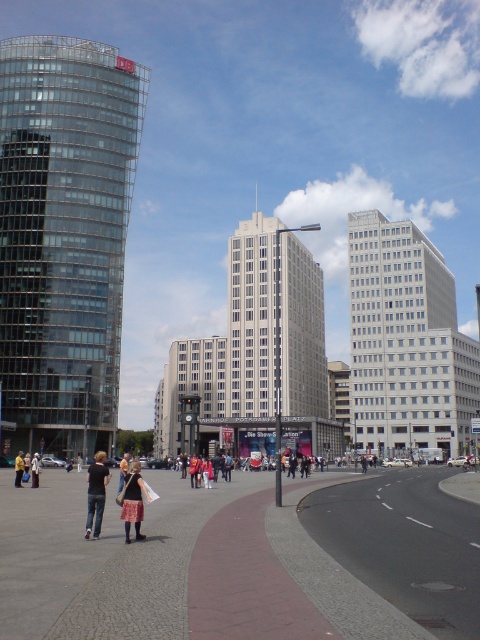
You are a photographer trying to capture the glassy modern skyscraper at left and the yellow fabric bag at lower center in the same frame. Based on their sizes, which object should you focus on first to ensure both are in the shot?

The glassy modern skyscraper at left is wider than the yellow fabric bag at lower center, so you should focus on the glassy modern skyscraper at left first to ensure both fit in the frame.

In the scene shown: You are a tourist visiting Potsdamer Platz and want to take a photo of the white glass building at center. However, there is a person wearing a matte black jacket at lower center blocking your view. Can you estimate if the person is shorter than the building?

The white glass building at center is taller than the matte black jacket at lower center, so yes, the person wearing the matte black jacket at lower center is shorter than the building and might not fully block the view.